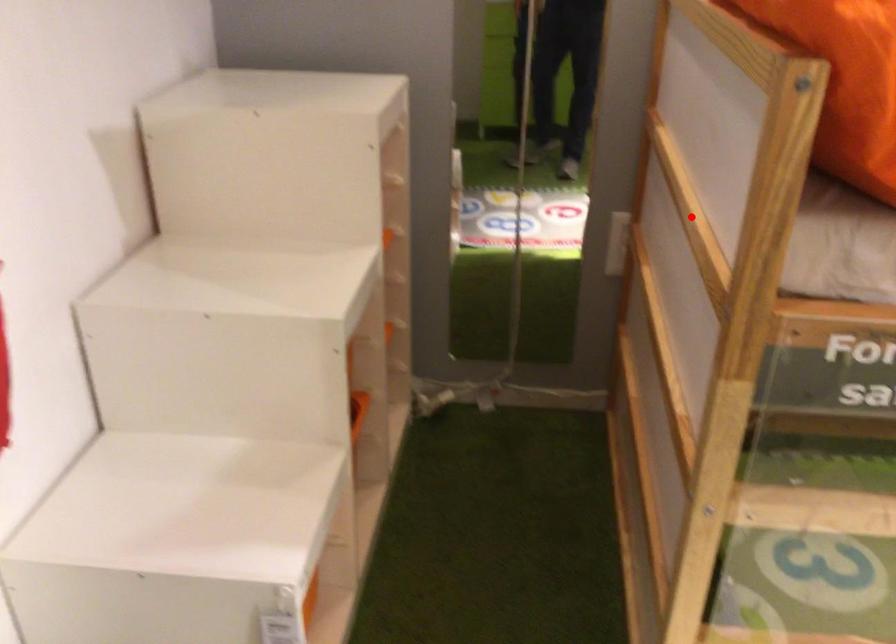
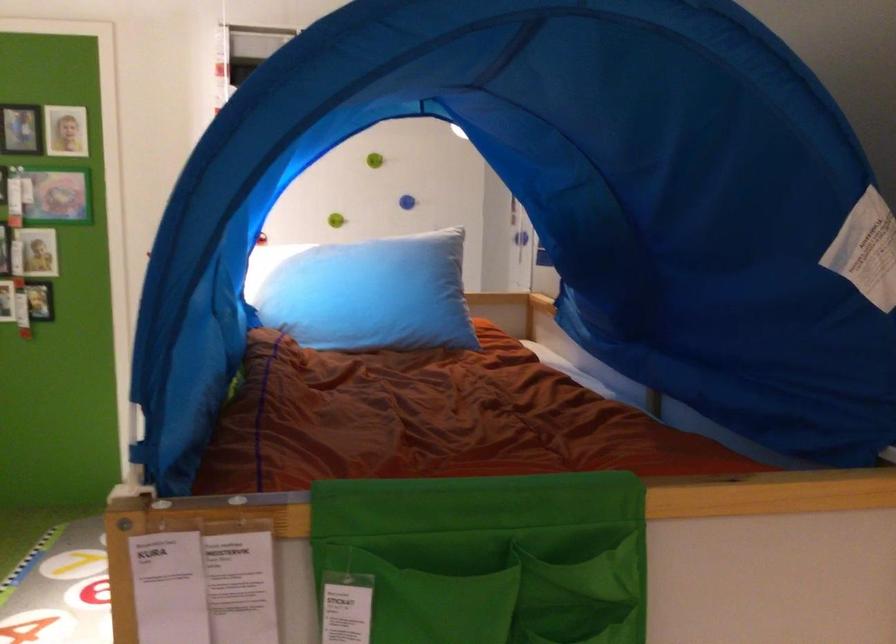
Question: I am providing you with two images of the same scene from different viewpoints. A red point is marked on the first image. Is the red point's position out of view in image 2?

Choices:
 (A) Yes
 (B) No

Answer: (A)